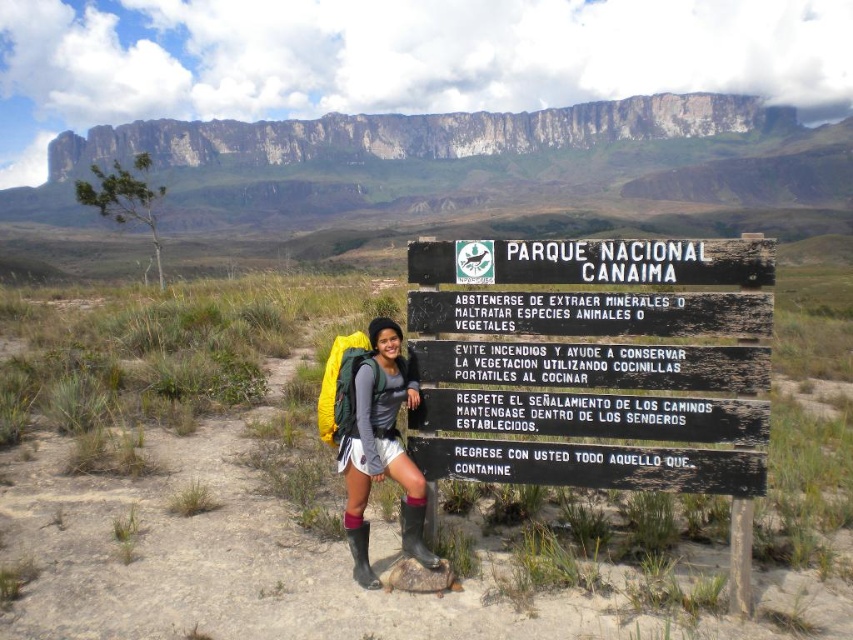
Does black wooden sign at center have a lesser height compared to white rocky cliff at upper center?

Yes, black wooden sign at center is shorter than white rocky cliff at upper center.

Can you confirm if black wooden sign at center is taller than white rocky cliff at upper center?

In fact, black wooden sign at center may be shorter than white rocky cliff at upper center.

Is point (670, 307) positioned after point (543, 132)?

That is False.

This screenshot has height=640, width=853. Find the location of `black wooden sign at center`. black wooden sign at center is located at coordinates (592, 342).

Does white rocky cliff at upper center have a lesser width compared to matte green backpack at center?

No.

Can you confirm if white rocky cliff at upper center is positioned to the right of matte green backpack at center?

In fact, white rocky cliff at upper center is to the left of matte green backpack at center.

At what (x,y) coordinates should I click in order to perform the action: click on white rocky cliff at upper center. Please return your answer as a coordinate pair (x, y). Image resolution: width=853 pixels, height=640 pixels. Looking at the image, I should click on (416, 132).

The image size is (853, 640). I want to click on white rocky cliff at upper center, so click(x=416, y=132).

Who is higher up, black wooden sign at center or matte green backpack at center?

black wooden sign at center is above.

The height and width of the screenshot is (640, 853). Find the location of `black wooden sign at center`. black wooden sign at center is located at coordinates [592, 342].

This screenshot has width=853, height=640. Describe the element at coordinates (592, 342) in the screenshot. I see `black wooden sign at center` at that location.

The image size is (853, 640). In order to click on black wooden sign at center in this screenshot , I will do `click(592, 342)`.